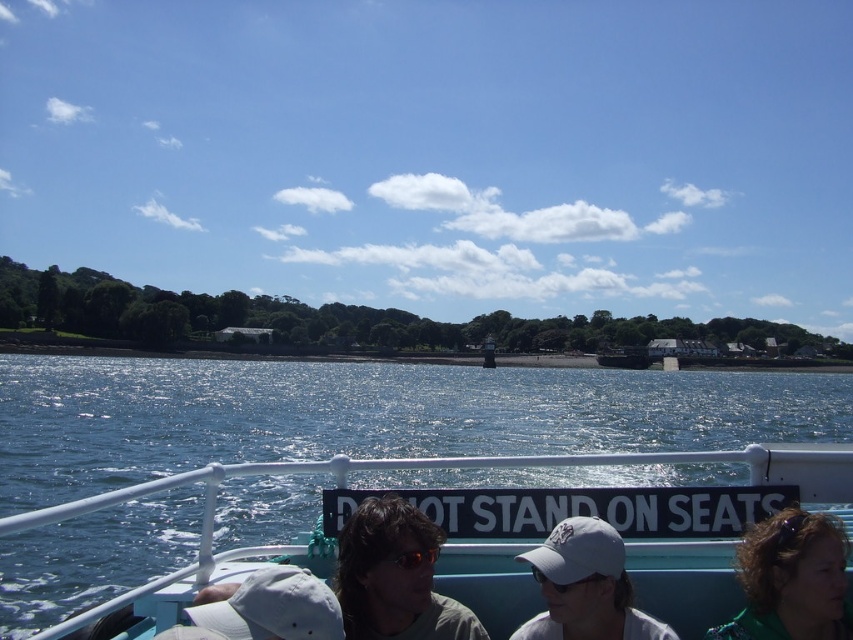
You are on a sunny day boat trip and need to store your belongings. You have a blue plastic boat at center and a white matte baseball cap at lower center. Which item can you use to store your items, and why?

The blue plastic boat at center is larger in size than the white matte baseball cap at lower center, so you can use the blue plastic boat at center to store your items as it has more space.

You are a photographer on the boat deck and need to position a tripod between the matte gray sunglasses at center and the green fabric jacket at lower right. Which object should the tripod be placed closer to to ensure it doesn

The matte gray sunglasses at center is taller than the green fabric jacket at lower right, so the tripod should be placed closer to the green fabric jacket at lower right to maintain balance between the two objects.